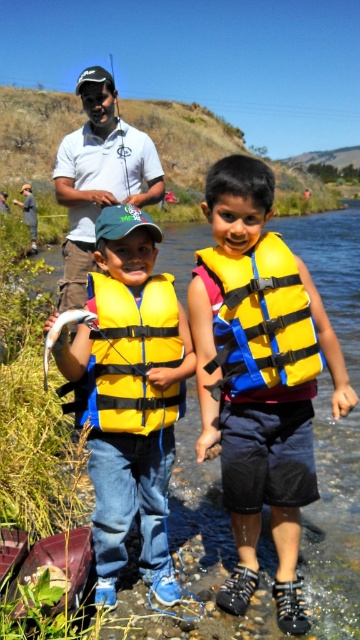
Describe the element at coordinates (131, 396) in the screenshot. The image size is (360, 640). I see `yellow matte life vest at center` at that location.

Can you confirm if yellow matte life vest at center is bigger than yellow matte life jacket at center?

Yes.

Between point (47, 323) and point (90, 289), which one is positioned in front?

Point (47, 323) is in front.

This screenshot has width=360, height=640. I want to click on yellow matte life vest at center, so click(131, 396).

Which is more to the left, yellow matte life vest at center or yellow/blue fabric life jacket at center?

Positioned to the left is yellow matte life vest at center.

Who is shorter, yellow matte life vest at center or yellow/blue fabric life jacket at center?

yellow/blue fabric life jacket at center is shorter.

Describe the element at coordinates (131, 396) in the screenshot. I see `yellow matte life vest at center` at that location.

This screenshot has height=640, width=360. Find the location of `yellow matte life vest at center`. yellow matte life vest at center is located at coordinates (131, 396).

Which is above, yellow matte life vest at center or matte white polo shirt at upper center?

matte white polo shirt at upper center is above.

Does yellow matte life vest at center appear on the left side of matte white polo shirt at upper center?

Incorrect, yellow matte life vest at center is not on the left side of matte white polo shirt at upper center.

Where is `yellow matte life vest at center`? Image resolution: width=360 pixels, height=640 pixels. yellow matte life vest at center is located at coordinates (131, 396).

Identify the location of yellow matte life vest at center. This screenshot has width=360, height=640. click(131, 396).